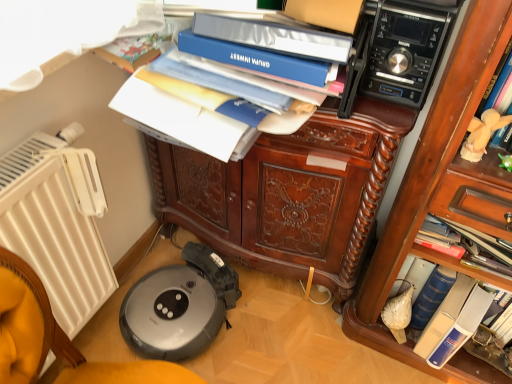
Question: Is blue hardcover book at lower right, which is the 2th paperback book from left to right, turned away from white plastic radiator at left?

Choices:
 (A) no
 (B) yes

Answer: (A)

Question: From the image's perspective, is blue hardcover book at lower right, the 1th paperback book from the back, over white plastic radiator at left?

Choices:
 (A) yes
 (B) no

Answer: (B)

Question: Does blue hardcover book at lower right, which ranks as the first paperback book in bottom-to-top order, have a greater width compared to white plastic radiator at left?

Choices:
 (A) no
 (B) yes

Answer: (B)

Question: Can you confirm if blue hardcover book at lower right, the 1th paperback book from the back, is taller than white plastic radiator at left?

Choices:
 (A) yes
 (B) no

Answer: (B)

Question: From a real-world perspective, is blue hardcover book at lower right, which ranks as the first paperback book in bottom-to-top order, located higher than white plastic radiator at left?

Choices:
 (A) no
 (B) yes

Answer: (A)

Question: In terms of size, does white plush toy at upper right appear bigger or smaller than white plastic radiator at left?

Choices:
 (A) small
 (B) big

Answer: (A)

Question: In the image, is white plush toy at upper right positioned in front of or behind white plastic radiator at left?

Choices:
 (A) behind
 (B) front

Answer: (A)

Question: In terms of width, does white plush toy at upper right look wider or thinner when compared to white plastic radiator at left?

Choices:
 (A) thin
 (B) wide

Answer: (A)

Question: Would you say white plush toy at upper right is to the left or to the right of white plastic radiator at left in the picture?

Choices:
 (A) right
 (B) left

Answer: (A)

Question: Is point (426, 44) positioned closer to the camera than point (269, 36)?

Choices:
 (A) farther
 (B) closer

Answer: (A)

Question: Based on their sizes in the image, would you say black plastic stereo at upper right is bigger or smaller than blue matte folder at upper center?

Choices:
 (A) small
 (B) big

Answer: (B)

Question: From a real-world perspective, is black plastic stereo at upper right above or below blue matte folder at upper center?

Choices:
 (A) below
 (B) above

Answer: (A)

Question: From their relative heights in the image, would you say black plastic stereo at upper right is taller or shorter than blue matte folder at upper center?

Choices:
 (A) tall
 (B) short

Answer: (A)

Question: Is white plastic radiator at left taller or shorter than blue matte folder at upper center, which appears as the 2th paperback book when ordered from the bottom?

Choices:
 (A) short
 (B) tall

Answer: (B)

Question: Considering the positions of white plastic radiator at left and blue matte folder at upper center, which appears as the 2th paperback book when ordered from the bottom, in the image, is white plastic radiator at left bigger or smaller than blue matte folder at upper center, which appears as the 2th paperback book when ordered from the bottom,?

Choices:
 (A) big
 (B) small

Answer: (A)